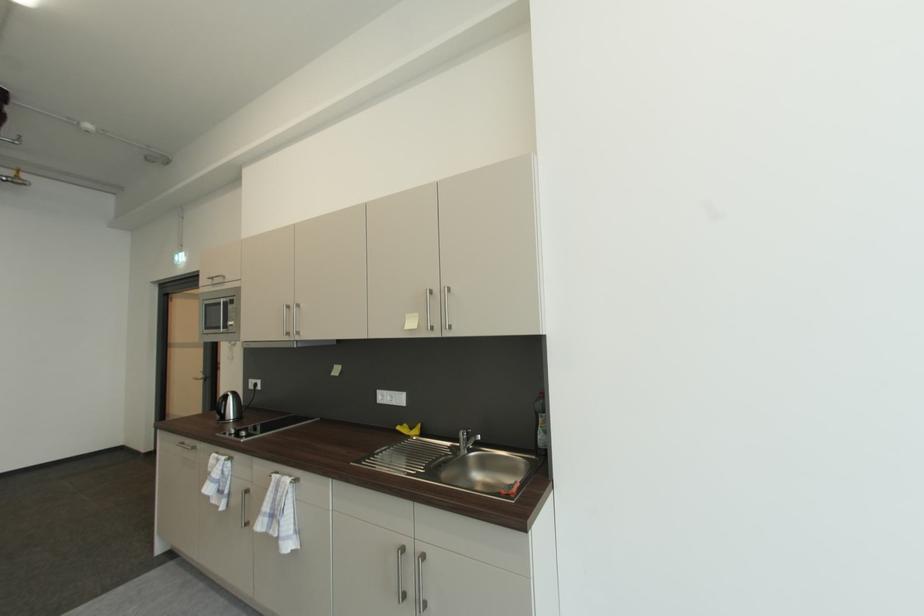
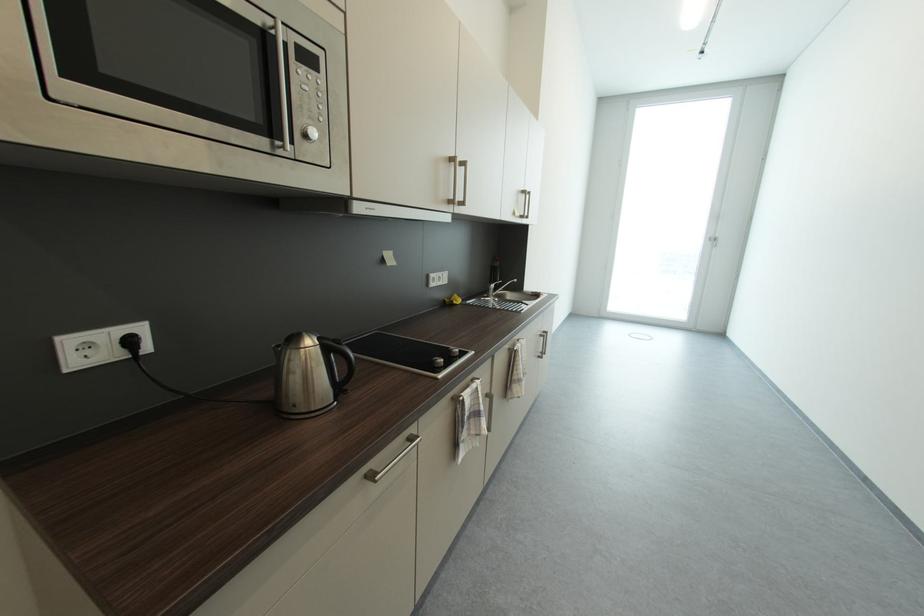
Locate, in the second image, the point that corresponds to (x=262, y=387) in the first image.

(137, 344)